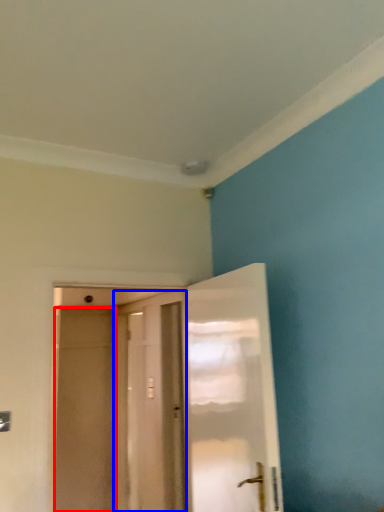
Question: Which object is closer to the camera taking this photo, screen door (highlighted by a red box) or door (highlighted by a blue box)?

Choices:
 (A) screen door
 (B) door

Answer: (B)